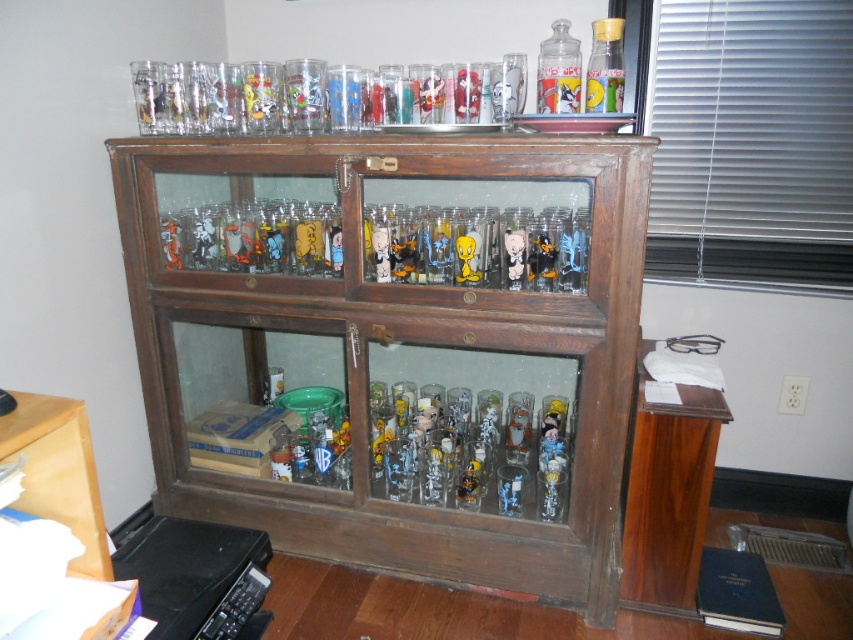
You are an interior designer planning to place a new shelf above the clear glass cabinet at upper center and the white glossy figurine at center. Based on their heights, which object requires the shelf to be placed higher to avoid blocking the view of the taller one?

The clear glass cabinet at upper center is much taller than the white glossy figurine at center, so the shelf should be placed higher to avoid blocking the view of the clear glass cabinet at upper center.

You are organizing a shelf in the office and need to place both the clear glass jar at upper center and the matte plastic figurine at center. Which object requires more space due to its size?

The clear glass jar at upper center requires more space because it is bigger than the matte plastic figurine at center.

You are standing in front of a wooden display cabinet with glass doors. You notice two points marked on the cabinet. One is at coordinate point (483, 349) and the other at point (512, 241). Which point is closer to you?

Point (483, 349) is further to the viewer than point (512, 241), so the point closer to you is point (512, 241).